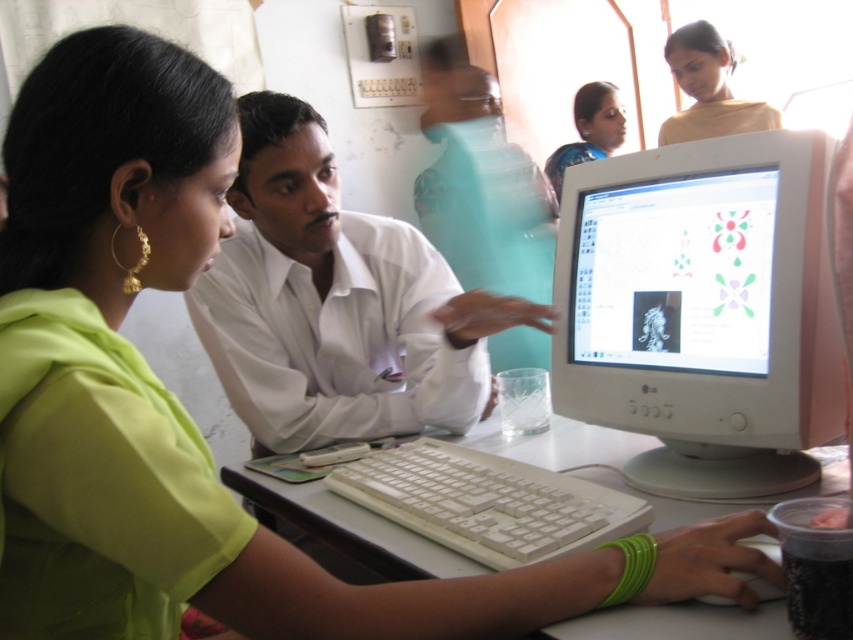
You are a photographer setting up for a portrait session. You need to position a light source to the right of the matte green saree at upper center and ensure it doesn not cast a shadow on the white plastic keyboard at lower center. Where should you place the light source?

The white plastic keyboard at lower center is to the left of the matte green saree at upper center. Therefore, placing the light source to the right of the matte green saree at upper center would cast light away from the keyboard, avoiding shadows on it.

You are a photographer taking a picture of the scene. You want to focus on the white plastic keyboard at lower center and the matte green saree at upper center. Which object will appear larger in your photo?

The white plastic keyboard at lower center will appear larger in the photo because it is closer to the viewer than the matte green saree at upper center.

You are a delivery person who needs to place a protective sleeve over both the white plastic monitor at center and the white smooth shirt at center. Which object requires a sleeve with a smaller width?

The white plastic monitor at center is thinner than the white smooth shirt at center, so the sleeve for the white plastic monitor at center needs to be narrower.